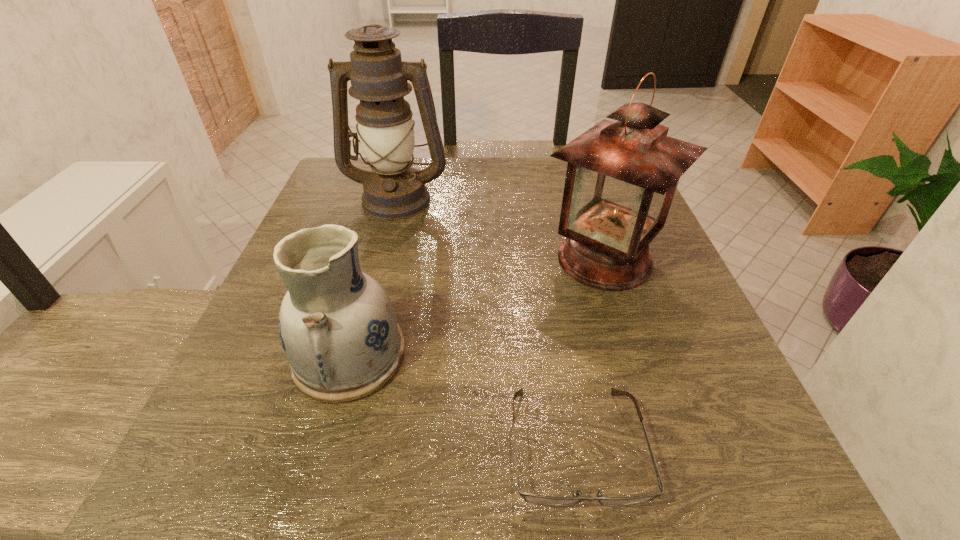
Where is `the farther oil lamp`? The height and width of the screenshot is (540, 960). the farther oil lamp is located at coordinates (394, 190).

Identify the location of the left oil lamp. This screenshot has height=540, width=960. (394, 190).

Locate an element on the screen. the nearer oil lamp is located at coordinates (622, 175).

Where is `the right oil lamp`? the right oil lamp is located at coordinates (622, 175).

Identify the location of pottery. (337, 325).

What are the coordinates of `spectacles` in the screenshot? It's located at (528, 497).

I want to click on free space located on the right of the left oil lamp, so click(469, 198).

Find the location of a particular element. This screenshot has width=960, height=540. vacant region located 0.070m on the left of the third nearest object is located at coordinates (501, 259).

At what (x,y) coordinates should I click in order to perform the action: click on free space located on the front of the pottery. Please return your answer as a coordinate pair (x, y). Image resolution: width=960 pixels, height=540 pixels. Looking at the image, I should click on (315, 483).

At what (x,y) coordinates should I click in order to perform the action: click on object located at the far edge. Please return your answer as a coordinate pair (x, y). Looking at the image, I should click on (394, 190).